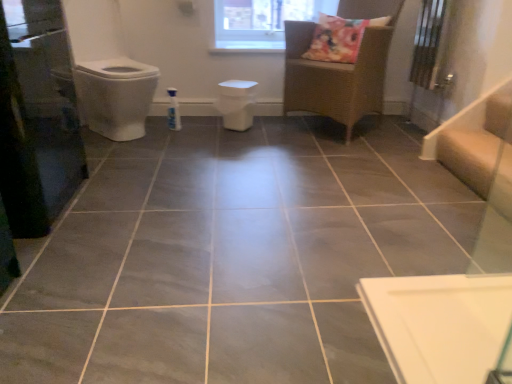
Question: Would you consider white matte toilet bowl at center to be distant from transparent glass window at upper center?

Choices:
 (A) yes
 (B) no

Answer: (B)

Question: Is white matte toilet bowl at center next to transparent glass window at upper center?

Choices:
 (A) yes
 (B) no

Answer: (B)

Question: Can you confirm if white matte toilet bowl at center is shorter than transparent glass window at upper center?

Choices:
 (A) no
 (B) yes

Answer: (B)

Question: Is white matte toilet bowl at center bigger than transparent glass window at upper center?

Choices:
 (A) yes
 (B) no

Answer: (B)

Question: Does white matte toilet bowl at center have a greater height compared to transparent glass window at upper center?

Choices:
 (A) no
 (B) yes

Answer: (A)

Question: Is woven rattan chair at upper center in front of or behind white matte toilet bowl at center in the image?

Choices:
 (A) front
 (B) behind

Answer: (A)

Question: Is woven rattan chair at upper center taller or shorter than white matte toilet bowl at center?

Choices:
 (A) tall
 (B) short

Answer: (A)

Question: Would you say woven rattan chair at upper center is to the left or to the right of white matte toilet bowl at center in the picture?

Choices:
 (A) right
 (B) left

Answer: (A)

Question: Looking at their shapes, would you say woven rattan chair at upper center is wider or thinner than white matte toilet bowl at center?

Choices:
 (A) thin
 (B) wide

Answer: (B)

Question: From the image's perspective, is woven rattan chair at upper center above or below transparent glass screen door at left?

Choices:
 (A) above
 (B) below

Answer: (A)

Question: From their relative heights in the image, would you say woven rattan chair at upper center is taller or shorter than transparent glass screen door at left?

Choices:
 (A) short
 (B) tall

Answer: (A)

Question: Does point (340, 62) appear closer or farther from the camera than point (31, 208)?

Choices:
 (A) farther
 (B) closer

Answer: (A)

Question: Looking at the image, does woven rattan chair at upper center seem bigger or smaller compared to transparent glass screen door at left?

Choices:
 (A) small
 (B) big

Answer: (B)

Question: Is white matte toilet bowl at center inside the boundaries of woven rattan chair at upper center, or outside?

Choices:
 (A) inside
 (B) outside

Answer: (B)

Question: Is white matte toilet bowl at center to the left or to the right of woven rattan chair at upper center in the image?

Choices:
 (A) left
 (B) right

Answer: (A)